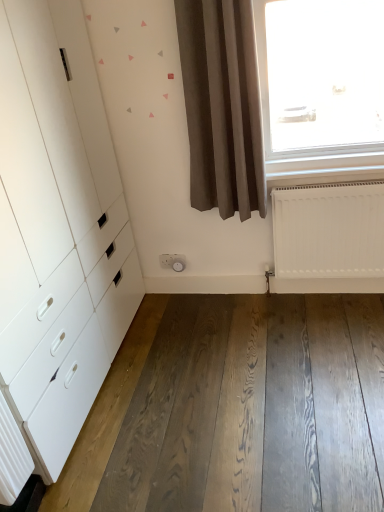
The image size is (384, 512). I want to click on free point below brown matte curtain at center (from a real-world perspective), so click(229, 300).